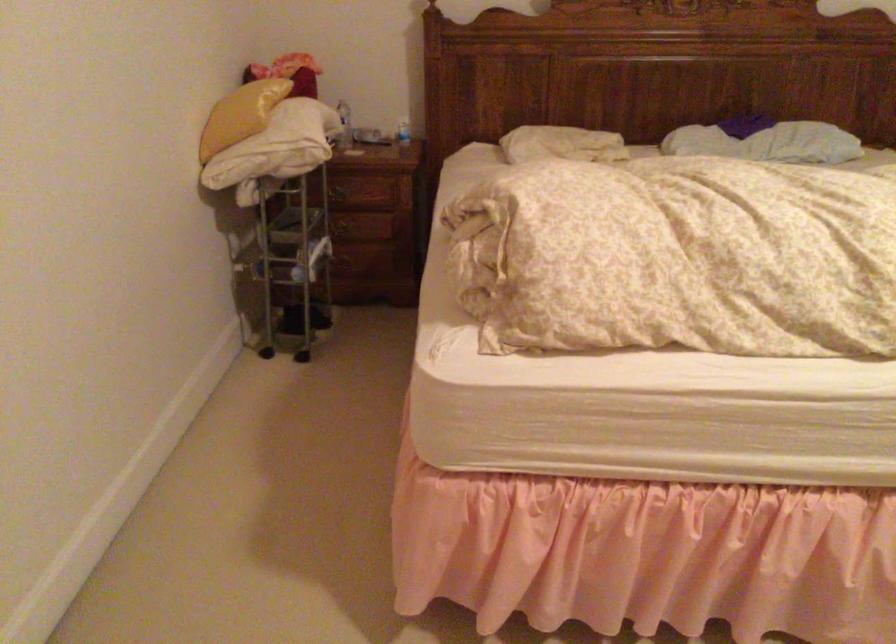
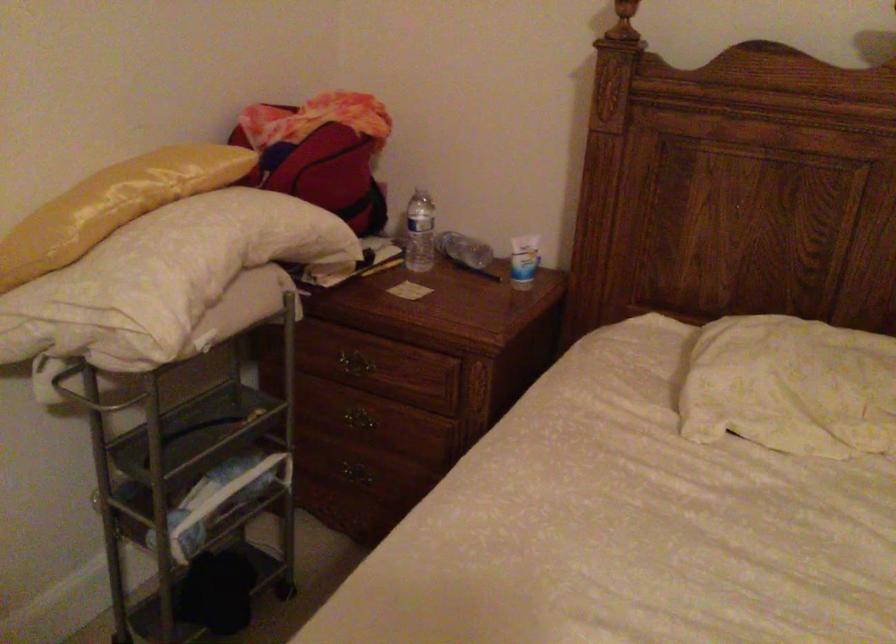
The point at (340, 194) is marked in the first image. Where is the corresponding point in the second image?

(350, 365)